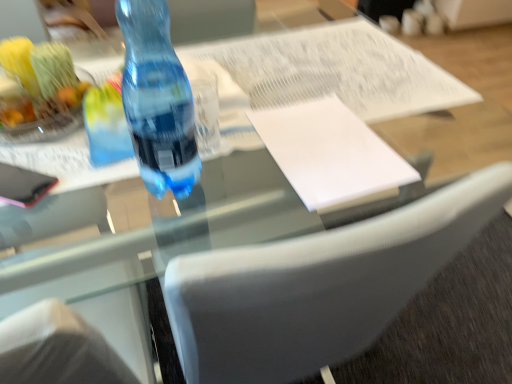
Question: From the image's perspective, relative to blue translucent bottle at center, is white paper at center above or below?

Choices:
 (A) above
 (B) below

Answer: (B)

Question: From a real-world perspective, is white paper at center above or below blue translucent bottle at center?

Choices:
 (A) above
 (B) below

Answer: (B)

Question: Estimate the real-world distances between objects in this image. Which object is closer to the blue translucent bottle at center?

Choices:
 (A) transparent plastic bottle at center
 (B) white paper at center
 (C) shiny plastic fruit bowl at upper left

Answer: (A)

Question: Which is farther from the blue translucent bottle at center?

Choices:
 (A) white paper at center
 (B) transparent plastic bottle at center
 (C) shiny plastic fruit bowl at upper left

Answer: (C)